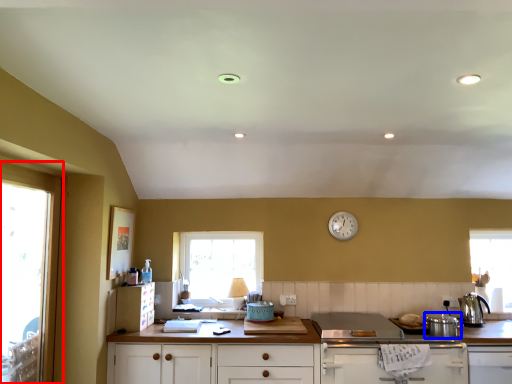
Question: Which of the following is the closest to the observer, window (highlighted by a red box) or appliance (highlighted by a blue box)?

Choices:
 (A) window
 (B) appliance

Answer: (A)